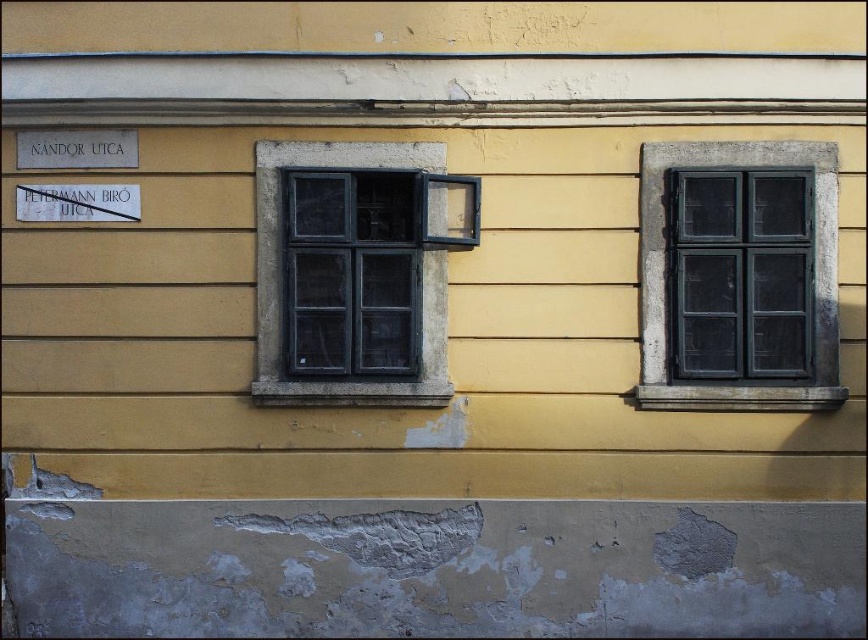
Does matte black window at upper right appear on the left side of matte black window at center?

In fact, matte black window at upper right is to the right of matte black window at center.

Measure the distance between matte black window at upper right and camera.

matte black window at upper right and camera are 7.43 meters apart from each other.

What are the coordinates of `matte black window at upper right` in the screenshot? It's located at 741,273.